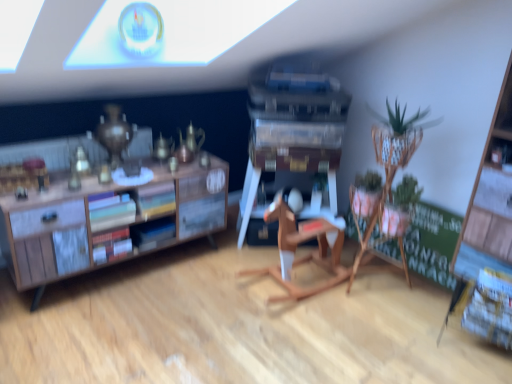
Locate an element on the screen. free spot in front of green chalkboard at right is located at coordinates (404, 315).